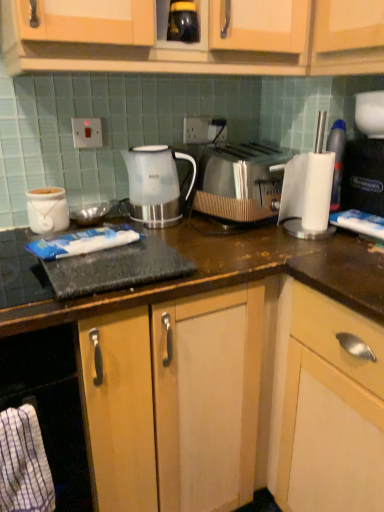
This screenshot has width=384, height=512. Describe the element at coordinates (181, 400) in the screenshot. I see `wooden cabinet at center` at that location.

Measure the distance between wooden cabinet at center and camera.

wooden cabinet at center is 32.56 inches from camera.

This screenshot has height=512, width=384. What do you see at coordinates (241, 181) in the screenshot?
I see `satin silver toaster at center` at bounding box center [241, 181].

Measure the distance between point (131, 175) and camera.

Point (131, 175) is 4.25 feet from camera.

The width and height of the screenshot is (384, 512). What do you see at coordinates (183, 21) in the screenshot?
I see `black glossy jar at upper center` at bounding box center [183, 21].

Locate an element on the screen. The width and height of the screenshot is (384, 512). white plastic cup at right is located at coordinates (337, 159).

What do you see at coordinates (337, 159) in the screenshot? I see `white plastic cup at right` at bounding box center [337, 159].

Locate an element on the screen. This screenshot has width=384, height=512. white plastic electric outlet at upper center, positioned as the 1th electric outlet in right-to-left order is located at coordinates pyautogui.click(x=204, y=130).

How much distance is there between white plastic electric outlet at upper center, which ranks as the 1th electric outlet in back-to-front order, and wooden cabinet at center?

white plastic electric outlet at upper center, which ranks as the 1th electric outlet in back-to-front order, is 33.62 inches away from wooden cabinet at center.

Does white plastic electric outlet at upper center, positioned as the 1th electric outlet in right-to-left order, have a greater height compared to wooden cabinet at center?

No, white plastic electric outlet at upper center, positioned as the 1th electric outlet in right-to-left order, is not taller than wooden cabinet at center.

What's the angular difference between white plastic electric outlet at upper center, arranged as the 2th electric outlet when viewed from the left, and wooden cabinet at center's facing directions?

white plastic electric outlet at upper center, arranged as the 2th electric outlet when viewed from the left, and wooden cabinet at center are facing 0.142 degrees away from each other.

Find the location of a particular element. The image size is (384, 512). cabinetry on the left of white plastic electric outlet at upper center, acting as the second electric outlet starting from the front is located at coordinates (181, 400).

From the image's perspective, which one is positioned higher, white plastic cup at right or black glossy jar at upper center?

black glossy jar at upper center is shown above in the image.

Considering the relative positions of white plastic cup at right and black glossy jar at upper center in the image provided, is white plastic cup at right in front of black glossy jar at upper center?

No, the depth of white plastic cup at right is greater than that of black glossy jar at upper center.

Can you confirm if white plastic cup at right is positioned to the left of black glossy jar at upper center?

Incorrect, white plastic cup at right is not on the left side of black glossy jar at upper center.

Which is less distant, (337, 132) or (178, 40)?

Point (337, 132).

Consider the image. From the image's perspective, which object appears higher, wooden cabinet at center or black plastic coffee machine at right?

From the image's view, black plastic coffee machine at right is above.

Considering the positions of objects wooden cabinet at center and black plastic coffee machine at right in the image provided, who is in front, wooden cabinet at center or black plastic coffee machine at right?

wooden cabinet at center is more forward.

Is wooden cabinet at center facing towards black plastic coffee machine at right?

No, wooden cabinet at center does not turn towards black plastic coffee machine at right.

Consider the image. How different are the orientations of white plastic electric outlet at upper center, which ranks as the 1th electric outlet in back-to-front order, and black plastic coffee machine at right in degrees?

white plastic electric outlet at upper center, which ranks as the 1th electric outlet in back-to-front order, and black plastic coffee machine at right are facing 82.7 degrees away from each other.

In the scene shown: Is white plastic electric outlet at upper center, which ranks as the 1th electric outlet in back-to-front order, located outside black plastic coffee machine at right?

Yes, white plastic electric outlet at upper center, which ranks as the 1th electric outlet in back-to-front order, is outside of black plastic coffee machine at right.

Is white plastic electric outlet at upper center, acting as the second electric outlet starting from the front, oriented towards black plastic coffee machine at right?

No, white plastic electric outlet at upper center, acting as the second electric outlet starting from the front, does not turn towards black plastic coffee machine at right.

Which point is more forward, (334, 194) or (44, 221)?

Positioned in front is point (44, 221).

Is white plastic cup at right positioned with its back to white glossy jar at left?

No, white plastic cup at right is not facing away from white glossy jar at left.

Based on the photo, is white plastic cup at right closer to the viewer compared to white glossy jar at left?

No, the depth of white plastic cup at right is greater than that of white glossy jar at left.

In terms of height, does white plastic cup at right look taller or shorter compared to white glossy jar at left?

white plastic cup at right is taller than white glossy jar at left.

Where is `cabinetry below the white plastic switch at upper center, which is counted as the first electric outlet, starting from the front (from the image's perspective)`? cabinetry below the white plastic switch at upper center, which is counted as the first electric outlet, starting from the front (from the image's perspective) is located at coordinates (181, 400).

Is wooden cabinet at center smaller than white plastic switch at upper center, marked as the 2th electric outlet in a back-to-front arrangement?

Actually, wooden cabinet at center might be larger than white plastic switch at upper center, marked as the 2th electric outlet in a back-to-front arrangement.

Would you consider wooden cabinet at center to be distant from white plastic switch at upper center, the 2th electric outlet positioned from the right?

They are positioned close to each other.

Is wooden cabinet at center further to the viewer compared to white plastic switch at upper center, marked as the 2th electric outlet in a back-to-front arrangement?

No, the depth of wooden cabinet at center is less than that of white plastic switch at upper center, marked as the 2th electric outlet in a back-to-front arrangement.

Is black glossy jar at upper center placed right next to white plastic electric outlet at upper center, arranged as the 2th electric outlet when viewed from the left?

black glossy jar at upper center and white plastic electric outlet at upper center, arranged as the 2th electric outlet when viewed from the left, are clearly separated.

Could you measure the distance between black glossy jar at upper center and white plastic electric outlet at upper center, positioned as the 1th electric outlet in right-to-left order?

black glossy jar at upper center and white plastic electric outlet at upper center, positioned as the 1th electric outlet in right-to-left order, are 16.53 inches apart.

Does black glossy jar at upper center have a lesser width compared to white plastic electric outlet at upper center, arranged as the 2th electric outlet when viewed from the left?

No.

Between black glossy jar at upper center and white plastic electric outlet at upper center, arranged as the 2th electric outlet when viewed from the left, which one appears on the left side from the viewer's perspective?

Positioned to the left is black glossy jar at upper center.

In order to click on electric outlet on the right of wooden cabinet at center in this screenshot , I will do `click(204, 130)`.

I want to click on beverage that appears on the left of white plastic cup at right, so click(x=183, y=21).

Based on their spatial positions, is white plastic electric outlet at upper center, which ranks as the 1th electric outlet in back-to-front order, or white glossy jar at left further from wooden cabinet at center?

white plastic electric outlet at upper center, which ranks as the 1th electric outlet in back-to-front order, lies further to wooden cabinet at center than the other object.

Based on their spatial positions, is wooden cabinet at center or black glossy jar at upper center further from black plastic coffee machine at right?

wooden cabinet at center is further to black plastic coffee machine at right.

Based on their spatial positions, is white plastic cup at right or translucent plastic kettle at center further from wooden cabinet at center?

Among the two, white plastic cup at right is located further to wooden cabinet at center.

Estimate the real-world distances between objects in this image. Which object is further from wooden cabinet at center, white glossy jar at left or satin silver toaster at center?

white glossy jar at left.

Considering their positions, is white plastic electric outlet at upper center, arranged as the 2th electric outlet when viewed from the left, positioned further to translucent plastic kettle at center than satin silver toaster at center?

white plastic electric outlet at upper center, arranged as the 2th electric outlet when viewed from the left, is positioned further to the anchor translucent plastic kettle at center.

When comparing their distances from white plastic electric outlet at upper center, which ranks as the 1th electric outlet in back-to-front order, does translucent plastic kettle at center or black glossy jar at upper center seem closer?

The object closer to white plastic electric outlet at upper center, which ranks as the 1th electric outlet in back-to-front order, is translucent plastic kettle at center.

Estimate the real-world distances between objects in this image. Which object is closer to translucent plastic kettle at center, satin silver toaster at center or black glossy jar at upper center?

The object closer to translucent plastic kettle at center is satin silver toaster at center.

Which object lies nearer to the anchor point translucent plastic kettle at center, wooden cabinet at center or black glossy jar at upper center?

black glossy jar at upper center lies closer to translucent plastic kettle at center than the other object.

Image resolution: width=384 pixels, height=512 pixels. I want to click on toaster located between black glossy jar at upper center and black plastic coffee machine at right in the left-right direction, so click(241, 181).

Where is `cabinetry located between white glossy jar at left and white plastic cup at right in the left-right direction`? The image size is (384, 512). cabinetry located between white glossy jar at left and white plastic cup at right in the left-right direction is located at coordinates (181, 400).

The image size is (384, 512). Identify the location of beverage between white plastic switch at upper center, marked as the 2th electric outlet in a back-to-front arrangement, and black plastic coffee machine at right, in the horizontal direction. (183, 21).

Locate an element on the screen. This screenshot has width=384, height=512. beverage between white plastic switch at upper center, which is counted as the first electric outlet, starting from the front, and satin silver toaster at center, in the horizontal direction is located at coordinates (183, 21).